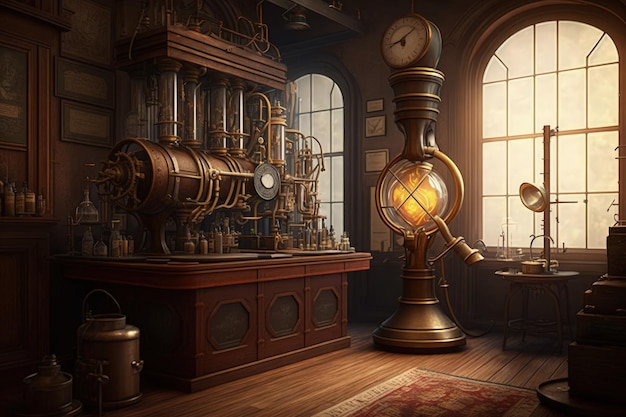
At what (x,y) coordinates should I click in order to perform the action: click on wood cabinet. Please return your answer as a coordinate pair (x, y). The width and height of the screenshot is (626, 417). Looking at the image, I should click on (255, 268).